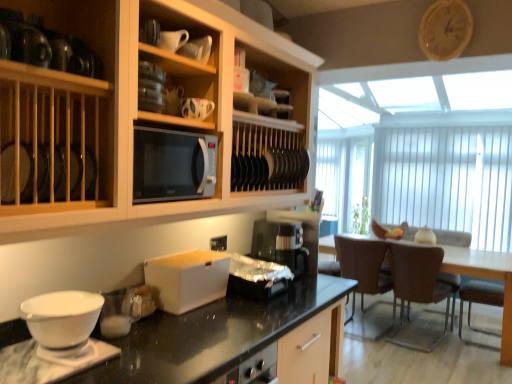
Image resolution: width=512 pixels, height=384 pixels. Identify the location of wooden clock at upper right. (445, 30).

Find the location of `white vertical blinds at right`. white vertical blinds at right is located at coordinates click(x=446, y=180).

Find the location of a particular element. The height and width of the screenshot is (384, 512). matte ceramic mug at upper center, the first tableware positioned from the bottom is located at coordinates (196, 108).

Measure the distance between point (488, 290) and camera.

A distance of 3.70 meters exists between point (488, 290) and camera.

Measure the distance between point [249,282] and camera.

Point [249,282] is 1.99 meters away from camera.

In order to click on brown leather armchair at right, which ranks as the second armchair in front-to-back order in this screenshot , I will do `click(452, 238)`.

Is brown leather chair at right, acting as the 1th chair starting from the left, facing away from black plastic coffee maker at center?

That's right, brown leather chair at right, acting as the 1th chair starting from the left, is facing away from black plastic coffee maker at center.

From the picture: From a real-world perspective, relative to black plastic coffee maker at center, is brown leather chair at right, acting as the 1th chair starting from the left, vertically above or below?

In terms of real-world spatial position, brown leather chair at right, acting as the 1th chair starting from the left, is below black plastic coffee maker at center.

From a real-world perspective, which chair is the 2nd one underneath the black plastic coffee maker at center? Please provide its 2D coordinates.

[(362, 265)]

Does point (371, 289) lie in front of point (258, 232)?

No.

Is point (284, 262) positioned behind point (217, 273)?

Yes.

Would you say black plastic coffee maker at center is inside or outside white matte box at center?

The correct answer is: outside.

From a real-world perspective, which object rests below the other?

white matte box at center is physically lower.

Which object is wider, white matte box at center or brown leather armchair at lower right, the 1th armchair positioned from the front?

With larger width is brown leather armchair at lower right, the 1th armchair positioned from the front.

How much distance is there between white matte box at center and brown leather armchair at lower right, positioned as the second armchair in back-to-front order?

white matte box at center is 9.42 feet from brown leather armchair at lower right, positioned as the second armchair in back-to-front order.

Considering the sizes of objects white matte box at center and brown leather armchair at lower right, the 1th armchair positioned from the front, in the image provided, who is smaller, white matte box at center or brown leather armchair at lower right, the 1th armchair positioned from the front,?

white matte box at center is smaller.

Is satin silver microwave at center to the right of matte ceramic mug at upper center, positioned as the 1th tableware in top-to-bottom order, from the viewer's perspective?

No.

Between satin silver microwave at center and matte ceramic mug at upper center, positioned as the 1th tableware in top-to-bottom order, which one has more height?

Standing taller between the two is satin silver microwave at center.

Is satin silver microwave at center aimed at matte ceramic mug at upper center, the second tableware positioned from the back?

No, satin silver microwave at center does not turn towards matte ceramic mug at upper center, the second tableware positioned from the back.

This screenshot has width=512, height=384. Find the location of `tableware that is the 2nd object above the satin silver microwave at center (from a real-world perspective)`. tableware that is the 2nd object above the satin silver microwave at center (from a real-world perspective) is located at coordinates (173, 40).

From a real-world perspective, between brown leather chair at right, which appears as the 1th chair when viewed from the right, and wooden clock at upper right, who is vertically lower?

brown leather chair at right, which appears as the 1th chair when viewed from the right, is physically lower.

Looking at this image, which is closer, (395,254) or (434,13)?

Point (395,254).

Between brown leather chair at right, placed as the second chair when sorted from left to right, and wooden clock at upper right, which one appears on the right side from the viewer's perspective?

brown leather chair at right, placed as the second chair when sorted from left to right.

Is shiny metallic container at center positioned before matte ceramic mug at upper center, marked as the second tableware in a bottom-to-top arrangement?

No, it is behind matte ceramic mug at upper center, marked as the second tableware in a bottom-to-top arrangement.

Is shiny metallic container at center oriented towards matte ceramic mug at upper center, the second tableware positioned from the back?

No.

From the picture: Are shiny metallic container at center and matte ceramic mug at upper center, positioned as the 1th tableware in top-to-bottom order, located far from each other?

Yes.

Would you say shiny metallic container at center is outside matte ceramic mug at upper center, the second tableware positioned from the back?

Absolutely, shiny metallic container at center is external to matte ceramic mug at upper center, the second tableware positioned from the back.

Considering the relative positions of white vertical blinds at right and satin silver microwave at center in the image provided, is white vertical blinds at right to the left of satin silver microwave at center from the viewer's perspective?

No.

Looking at this image, between white vertical blinds at right and satin silver microwave at center, which one has less height?

Standing shorter between the two is satin silver microwave at center.

Considering the sizes of objects white vertical blinds at right and satin silver microwave at center in the image provided, who is bigger, white vertical blinds at right or satin silver microwave at center?

white vertical blinds at right.

How different are the orientations of white vertical blinds at right and satin silver microwave at center in degrees?

There is a 90.7-degree angle between the facing directions of white vertical blinds at right and satin silver microwave at center.

Where is `kitchen appliance lying on the left of brown leather chair at right, acting as the 1th chair starting from the left`? This screenshot has width=512, height=384. kitchen appliance lying on the left of brown leather chair at right, acting as the 1th chair starting from the left is located at coordinates (280, 244).

You are a GUI agent. You are given a task and a screenshot of the screen. Output one action in this format:
    pyautogui.click(x=<x>, y=<y>)
    Task: Click on the kitchen appliance above the white matte box at center (from the image's perspective)
    Image resolution: width=512 pixels, height=384 pixels.
    Given the screenshot: What is the action you would take?
    pyautogui.click(x=280, y=244)

Looking at the image, which one is located closer to brown leather armchair at right, positioned as the 1th armchair in back-to-front order, wooden cabinet at upper left or shiny metallic container at center?

Among the two, shiny metallic container at center is located nearer to brown leather armchair at right, positioned as the 1th armchair in back-to-front order.

When comparing their distances from satin silver microwave at center, does wooden clock at upper right or brown leather armchair at lower right, positioned as the second armchair in back-to-front order, seem closer?

Among the two, wooden clock at upper right is located nearer to satin silver microwave at center.

Looking at the image, which one is located closer to wooden cabinet at upper left, white matte box at center or brown leather armchair at right, which ranks as the second armchair in front-to-back order?

The object closer to wooden cabinet at upper left is white matte box at center.

From the image, which object appears to be nearer to brown leather chair at right, which appears as the 1th chair when viewed from the right, matte ceramic mug at upper center, marked as the second tableware in a bottom-to-top arrangement, or brown leather armchair at right, which ranks as the second armchair in front-to-back order?

Among the two, brown leather armchair at right, which ranks as the second armchair in front-to-back order, is located nearer to brown leather chair at right, which appears as the 1th chair when viewed from the right.

Based on their spatial positions, is white matte bowl at lower left or matte ceramic mug at upper center, the 1th tableware positioned from the back, closer to brown leather chair at right, the 2th chair viewed from the right?

matte ceramic mug at upper center, the 1th tableware positioned from the back, lies closer to brown leather chair at right, the 2th chair viewed from the right, than the other object.

Considering their positions, is brown leather chair at right, placed as the second chair when sorted from left to right, positioned closer to matte ceramic mug at upper center, the first tableware positioned from the bottom, than brown leather armchair at right, which ranks as the second armchair in front-to-back order?

brown leather chair at right, placed as the second chair when sorted from left to right, is positioned closer to the anchor matte ceramic mug at upper center, the first tableware positioned from the bottom.

Which object lies nearer to the anchor point white matte bowl at lower left, brown leather armchair at right, which ranks as the second armchair in front-to-back order, or satin silver microwave at center?

satin silver microwave at center is positioned closer to the anchor white matte bowl at lower left.

Based on their spatial positions, is brown leather chair at right, placed as the second chair when sorted from left to right, or wooden clock at upper right further from brown leather armchair at right, positioned as the 1th armchair in back-to-front order?

Among the two, wooden clock at upper right is located further to brown leather armchair at right, positioned as the 1th armchair in back-to-front order.

At what (x,y) coordinates should I click in order to perform the action: click on chair between wooden cabinet at upper left and brown leather armchair at lower right, positioned as the second armchair in back-to-front order, along the z-axis. Please return your answer as a coordinate pair (x, y). Looking at the image, I should click on (417, 283).

The image size is (512, 384). I want to click on tableware located between matte ceramic mug at upper center, the second tableware positioned from the back, and brown leather armchair at lower right, positioned as the second armchair in back-to-front order, in the left-right direction, so click(196, 108).

Find the location of a particular element. This screenshot has width=512, height=384. chair between matte ceramic mug at upper center, positioned as the 1th tableware in top-to-bottom order, and brown leather chair at right, the 2th chair viewed from the right, in the front-back direction is located at coordinates (417, 283).

This screenshot has height=384, width=512. I want to click on armchair between matte ceramic mug at upper center, the 1th tableware positioned from the back, and brown leather armchair at lower right, the 1th armchair positioned from the front, so click(x=452, y=238).